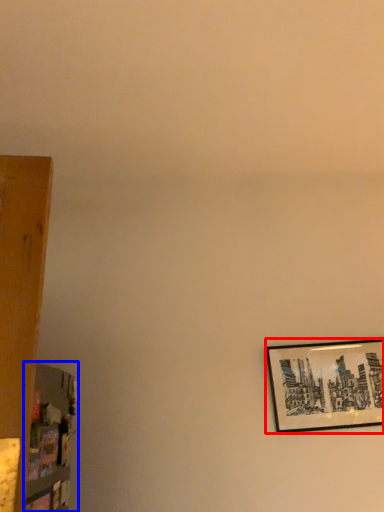
Question: Which object appears farthest to the camera in this image, picture frame (highlighted by a red box) or shelf (highlighted by a blue box)?

Choices:
 (A) picture frame
 (B) shelf

Answer: (A)